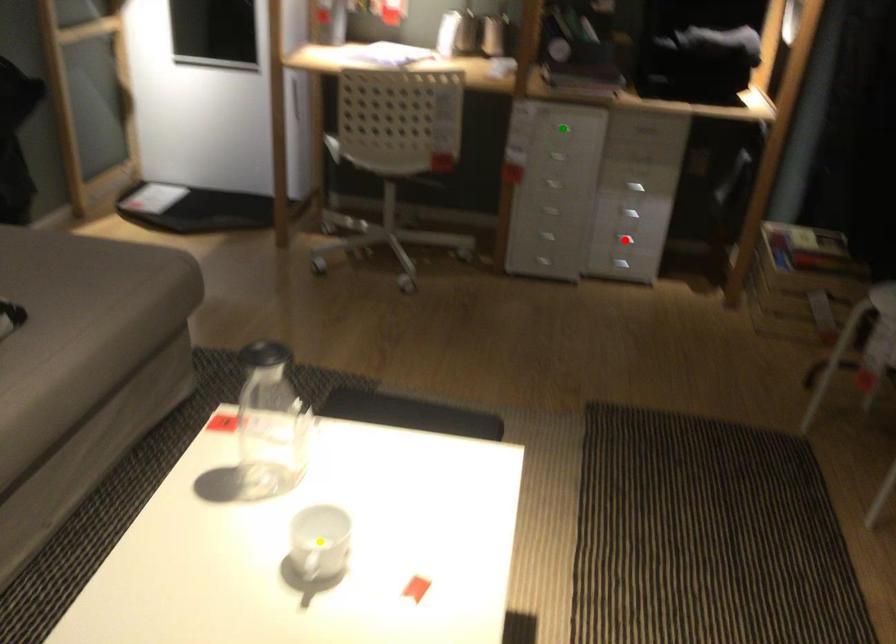
Order these from nearest to farthest:
green point, red point, yellow point

yellow point → green point → red point